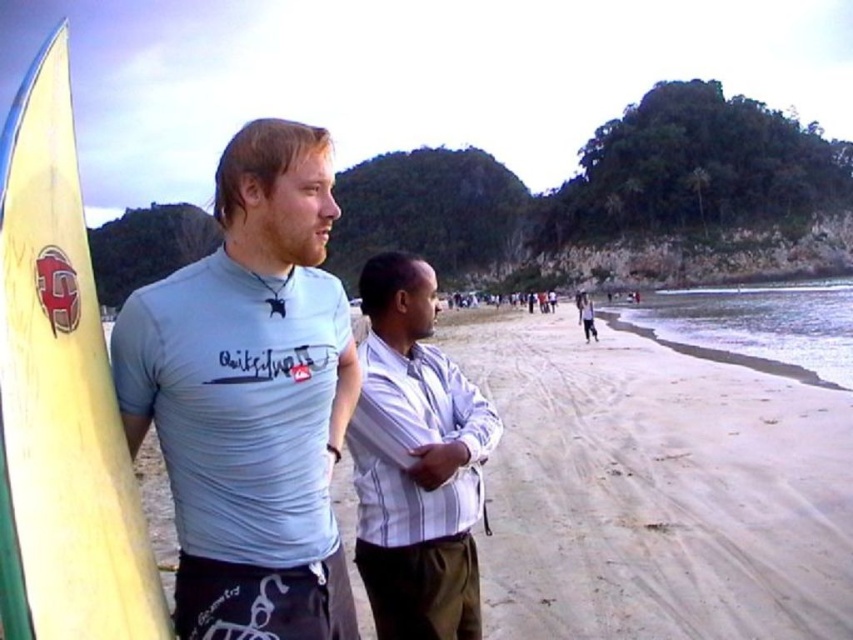
Question: In this image, where is light blue fabric shirt at left located relative to white striped shirt at center?

Choices:
 (A) right
 (B) left

Answer: (B)

Question: Which point is closer to the camera?

Choices:
 (A) click(x=70, y=356)
 (B) click(x=265, y=278)

Answer: (A)

Question: Which point is closer to the camera taking this photo?

Choices:
 (A) (438, 376)
 (B) (0, 531)
 (C) (230, 608)

Answer: (B)

Question: Does light blue fabric shirt at left have a greater width compared to yellow matte surfboard at left?

Choices:
 (A) no
 (B) yes

Answer: (A)

Question: In this image, where is light blue fabric shirt at left located relative to yellow matte surfboard at left?

Choices:
 (A) left
 (B) right

Answer: (B)

Question: Which point is farther to the camera?

Choices:
 (A) (135, 618)
 (B) (378, 561)

Answer: (B)